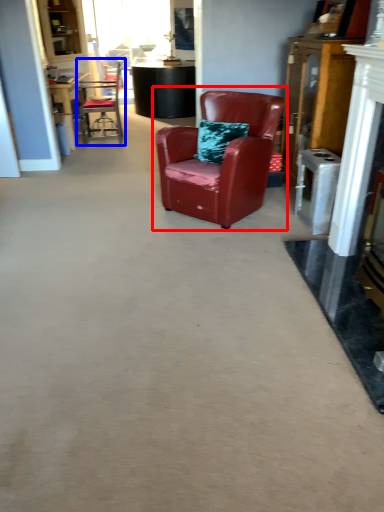
Question: Which object is closer to the camera taking this photo, chair (highlighted by a red box) or chair (highlighted by a blue box)?

Choices:
 (A) chair
 (B) chair

Answer: (A)